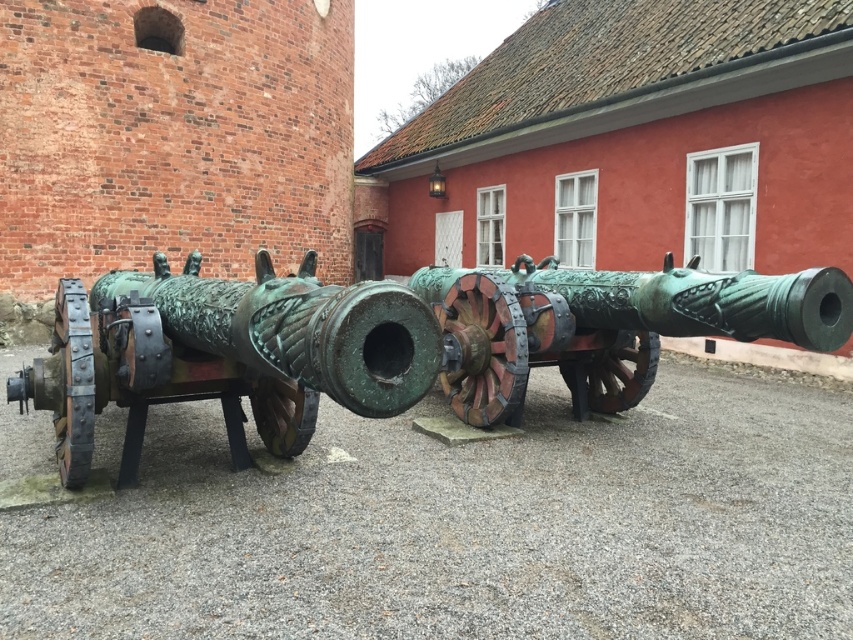
Question: Which of the following is the farthest from the observer?

Choices:
 (A) bronze textured cannon at center
 (B) green patina bronze cannon at left

Answer: (A)

Question: Does green patina bronze cannon at left appear on the right side of bronze textured cannon at center?

Choices:
 (A) yes
 (B) no

Answer: (B)

Question: Which object appears farthest from the camera in this image?

Choices:
 (A) bronze textured cannon at center
 (B) green patina bronze cannon at left

Answer: (A)

Question: Which object is farther from the camera taking this photo?

Choices:
 (A) green patina bronze cannon at left
 (B) bronze textured cannon at center

Answer: (B)

Question: Can you confirm if green patina bronze cannon at left is positioned below bronze textured cannon at center?

Choices:
 (A) yes
 (B) no

Answer: (A)

Question: Is green patina bronze cannon at left thinner than bronze textured cannon at center?

Choices:
 (A) no
 (B) yes

Answer: (A)